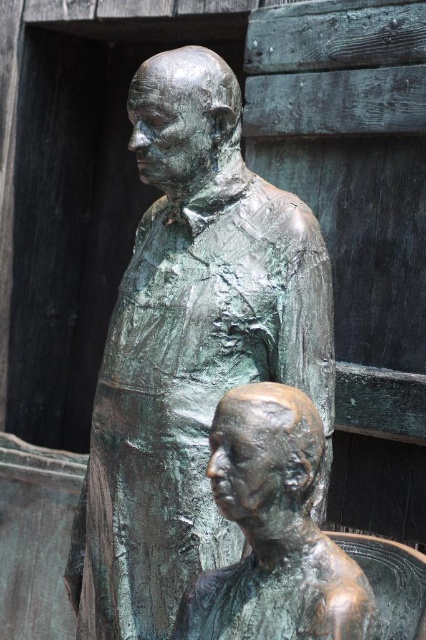
Question: Which of the following is the closest to the observer?

Choices:
 (A) (140, 371)
 (B) (224, 589)

Answer: (B)

Question: Among these objects, which one is farthest from the camera?

Choices:
 (A) bronze statue at lower center
 (B) green patina statue at center

Answer: (B)

Question: Can you confirm if green patina statue at center is positioned to the left of bronze statue at lower center?

Choices:
 (A) no
 (B) yes

Answer: (B)

Question: Considering the relative positions of green patina statue at center and bronze statue at lower center in the image provided, where is green patina statue at center located with respect to bronze statue at lower center?

Choices:
 (A) left
 (B) right

Answer: (A)

Question: Does green patina statue at center have a smaller size compared to bronze statue at lower center?

Choices:
 (A) no
 (B) yes

Answer: (A)